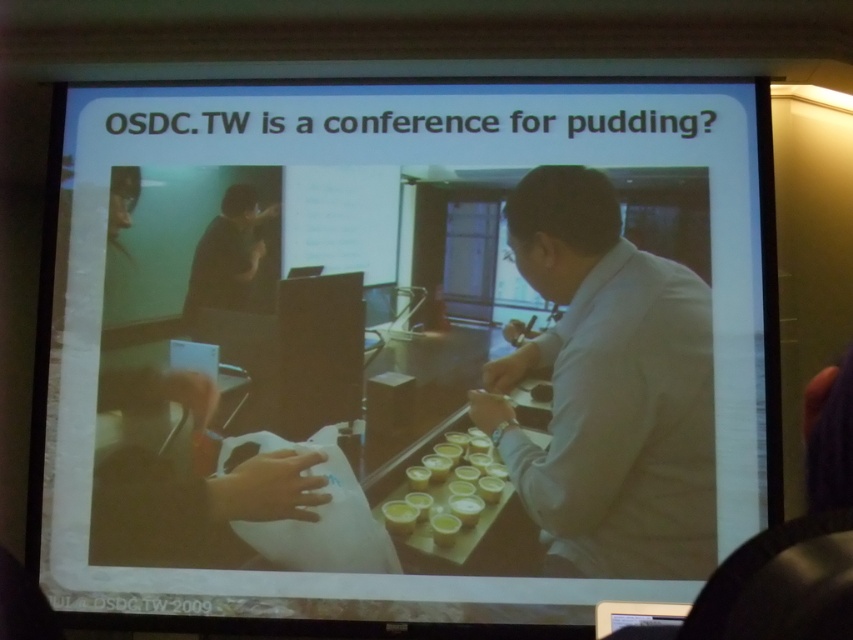
You are organizing a poster session at a conference and need to hang two papers on a bulletin board. The first is the white paper at center and the second is the white matte paper at lower left. Which paper should you hang higher up so that both can be seen clearly without overlapping?

The white paper at center is bigger than the white matte paper at lower left, so you should hang the white matte paper at lower left higher up so that the larger white paper at center can be placed below it without overlapping.

You are preparing for a presentation and need to place a white paper at center and a matte black laptop at center on a desk. According to the scene, which object should be placed higher up on the desk?

The matte black laptop at center should be placed higher up on the desk because the white paper at center is located below it in the scene.